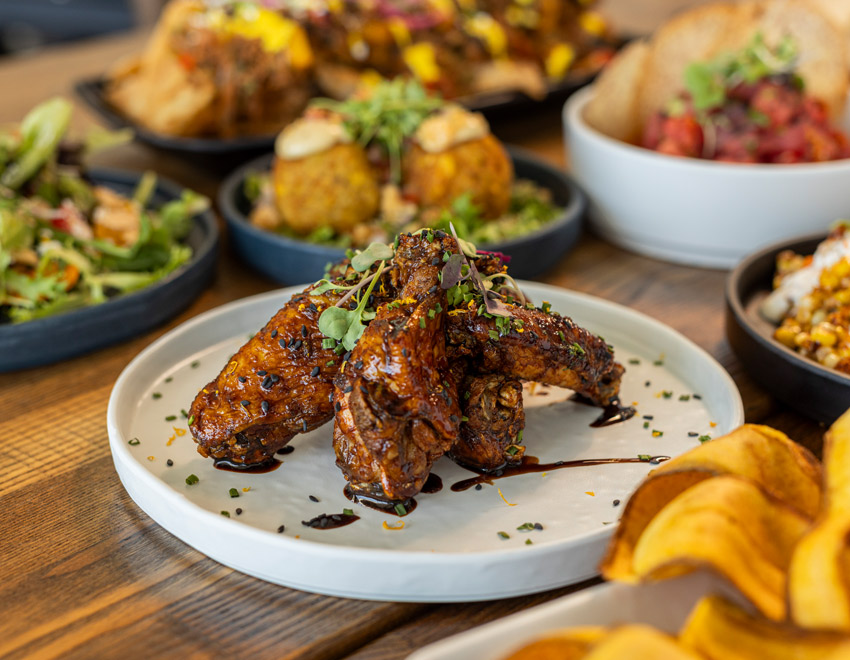
This screenshot has height=660, width=850. Identify the location of table. (41, 461).